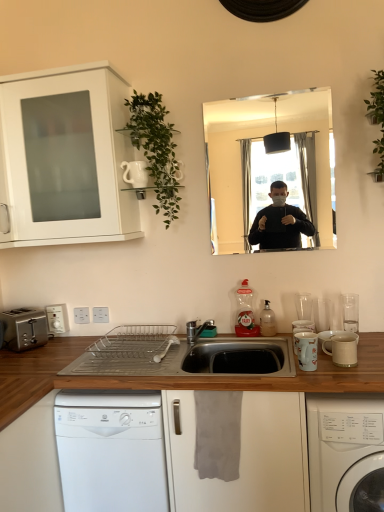
The image size is (384, 512). In order to click on free space above clear glass mirror at upper center (from a real-world perspective) in this screenshot , I will do 260,95.